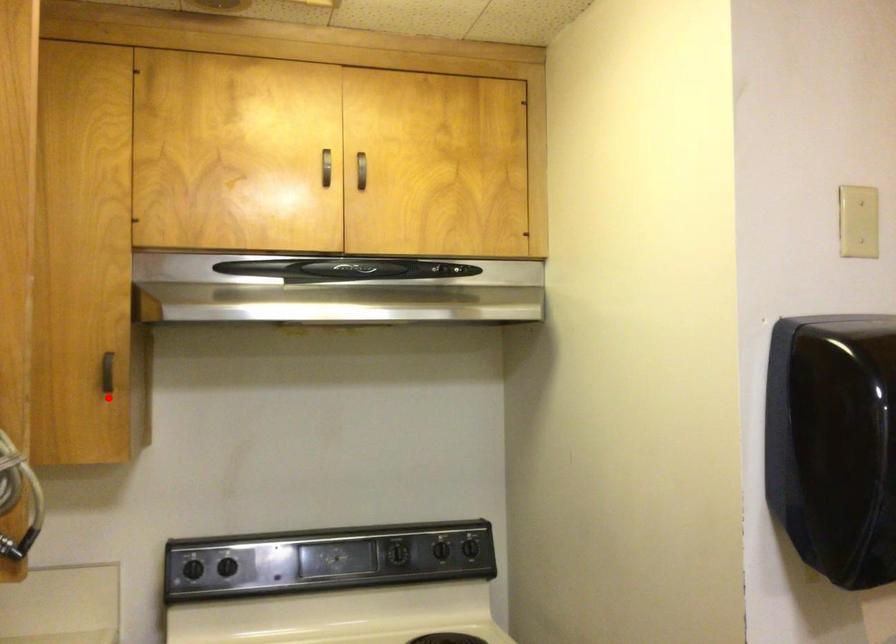
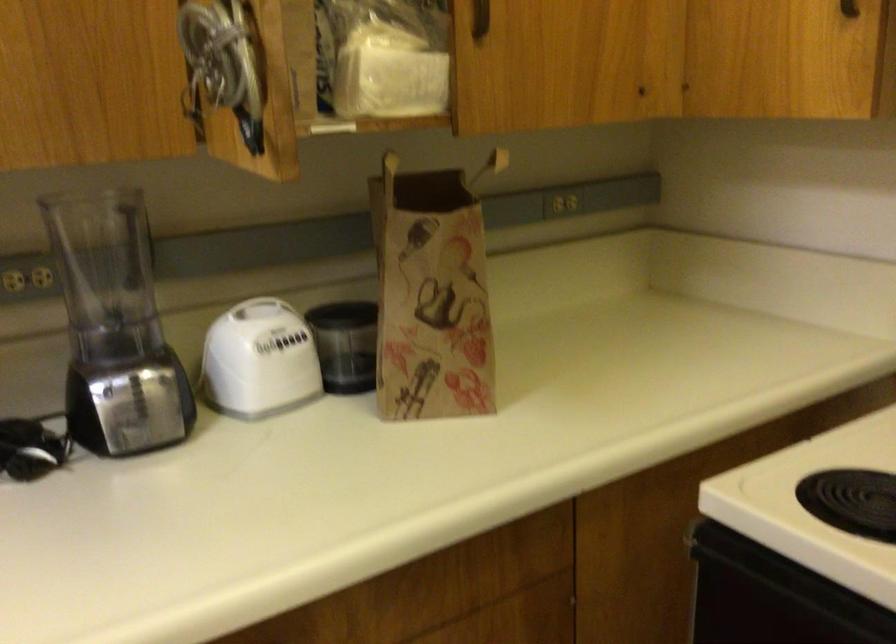
Question: I am providing you with two images of the same scene from different viewpoints. In image1, a red point is highlighted. Considering the same 3D point in image2, which of the following is correct?

Choices:
 (A) It is closer
 (B) It is farther

Answer: (A)